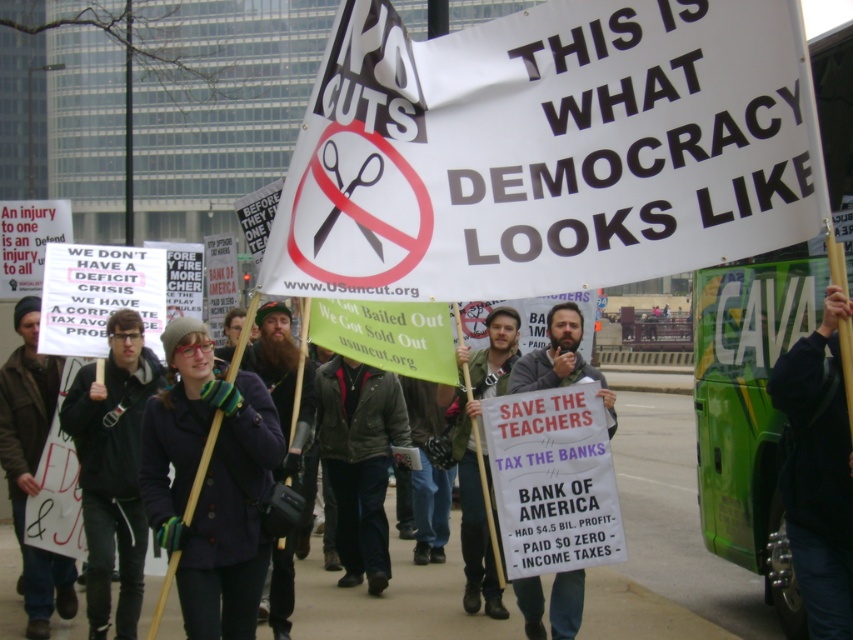
You are organizing a protest march and need to ensure participants can walk side by side without overcrowding. Given that the dark blue woolen coat at center and the green fabric jacket at center are both at the center, which of these two items of clothing would require more horizontal space between protesters?

The dark blue woolen coat at center requires more horizontal space because its width is larger than the green fabric jacket at center.

You are a photographer trying to capture a clear shot of both the dark gray hoodie at center and the green fabric jacket at center. Since you want both subjects to be in focus, you need to know their relative positions. Which one is closer to the camera?

The dark gray hoodie at center is positioned over the green fabric jacket at center, so the dark gray hoodie at center is closer to the camera.

What is the location of the point with coordinates (476, 456) in the image?

The point with coordinates (476, 456) is located on the green fabric jacket at center.